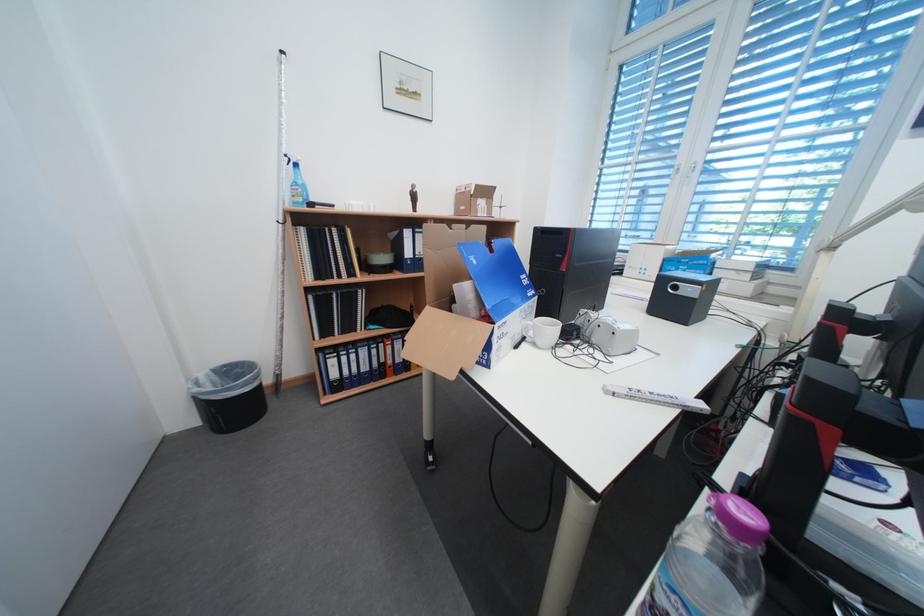
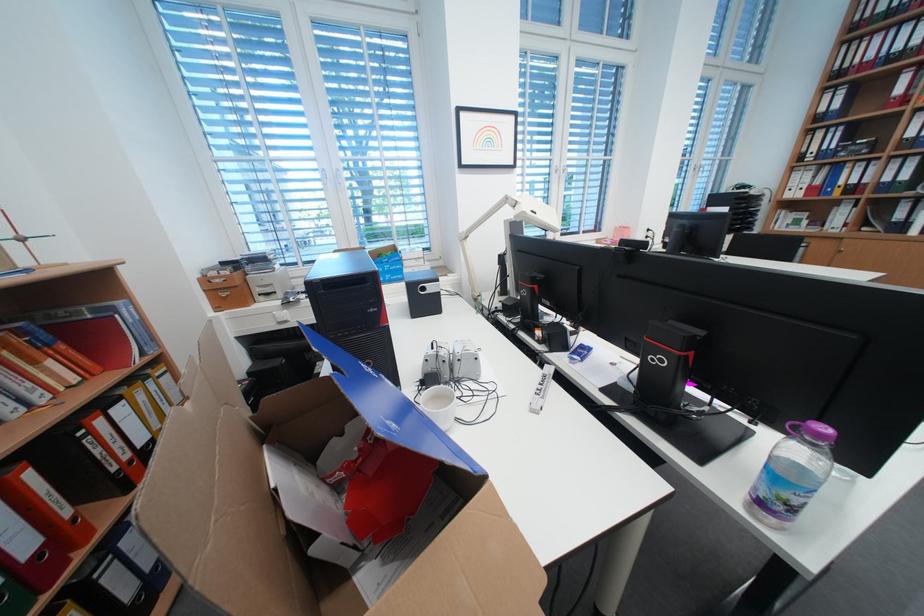
How did the camera likely rotate?

The camera's rotation is toward right-down.